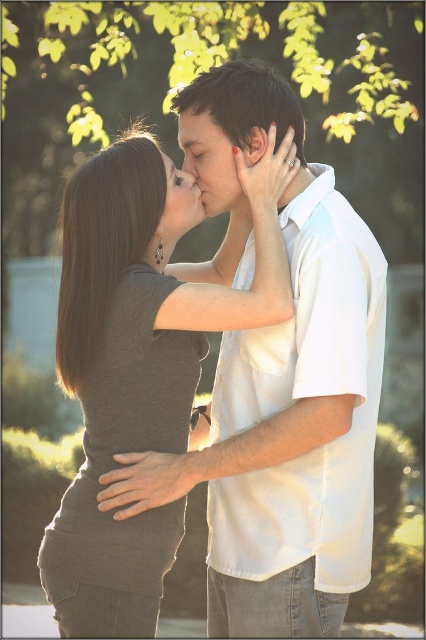
Can you confirm if matte gray shirt at center is thinner than smooth skin face at center?

No, matte gray shirt at center is not thinner than smooth skin face at center.

Who is lower down, matte gray shirt at center or smooth skin face at center?

matte gray shirt at center is lower down.

Image resolution: width=426 pixels, height=640 pixels. I want to click on matte gray shirt at center, so click(138, 369).

Find the location of a particular element. The height and width of the screenshot is (640, 426). matte gray shirt at center is located at coordinates (138, 369).

Can you confirm if matte gray shirt at center is positioned below matte white face at center?

Correct, matte gray shirt at center is located below matte white face at center.

Is point (69, 525) in front of point (175, 195)?

Yes, it is.

What are the coordinates of `matte gray shirt at center` in the screenshot? It's located at (138, 369).

Find the location of `white cotton shirt at center`. white cotton shirt at center is located at coordinates (287, 385).

Can you confirm if white cotton shirt at center is positioned below smooth skin face at center?

Yes, white cotton shirt at center is below smooth skin face at center.

This screenshot has width=426, height=640. Identify the location of white cotton shirt at center. (287, 385).

Locate an element on the screen. The image size is (426, 640). white cotton shirt at center is located at coordinates (287, 385).